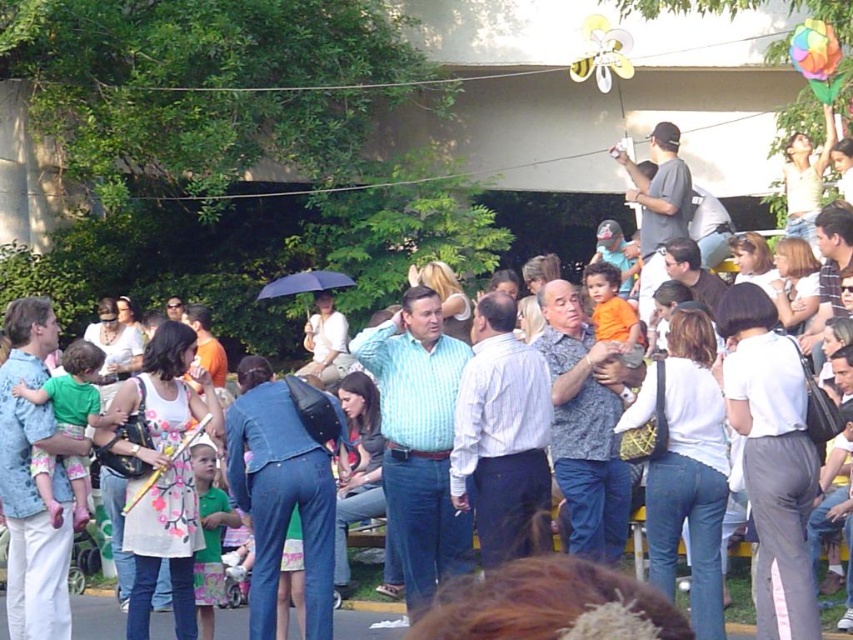
Question: Among these points, which one is farthest from the camera?

Choices:
 (A) (804, 61)
 (B) (300, 280)

Answer: (B)

Question: Among these points, which one is nearest to the camera?

Choices:
 (A) (811, 65)
 (B) (265, 292)

Answer: (A)

Question: Is rainbow fabric balloon at upper right in front of black matte umbrella at center?

Choices:
 (A) yes
 (B) no

Answer: (A)

Question: Is the position of rainbow fabric balloon at upper right less distant than that of black matte umbrella at center?

Choices:
 (A) no
 (B) yes

Answer: (B)

Question: Does rainbow fabric balloon at upper right appear on the left side of black matte umbrella at center?

Choices:
 (A) yes
 (B) no

Answer: (B)